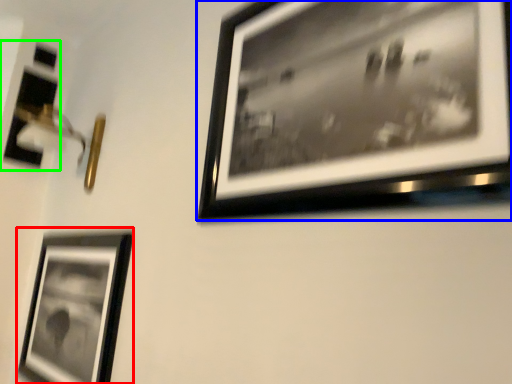
Question: Estimate the real-world distances between objects in this image. Which object is closer to picture frame (highlighted by a red box), picture frame (highlighted by a blue box) or picture frame (highlighted by a green box)?

Choices:
 (A) picture frame
 (B) picture frame

Answer: (A)